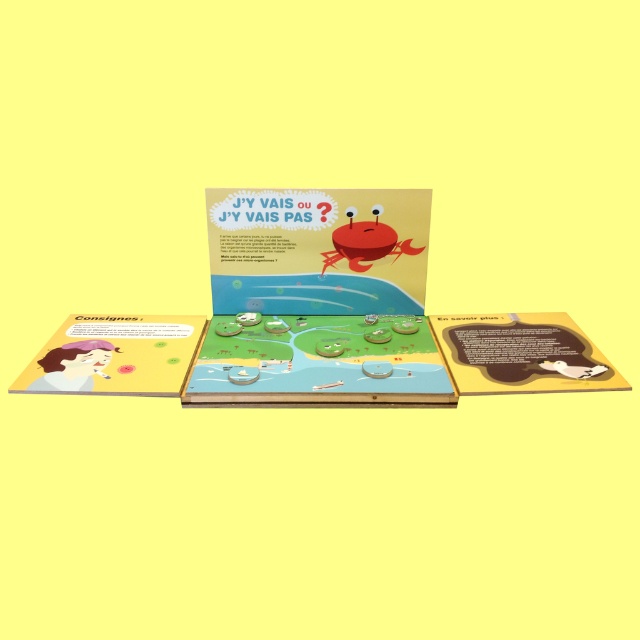
Can you confirm if matte plastic game board at center is shorter than matte yellow paper at lower left?

Incorrect, matte plastic game board at center's height does not fall short of matte yellow paper at lower left's.

Does point (220, 365) come behind point (112, 333)?

That is False.

This screenshot has height=640, width=640. I want to click on matte plastic game board at center, so click(320, 362).

Is matte plastic game board at center thinner than brown matte book at lower right?

No, matte plastic game board at center is not thinner than brown matte book at lower right.

Is point (330, 403) more distant than point (481, 342)?

No, (330, 403) is in front of (481, 342).

The image size is (640, 640). I want to click on matte plastic game board at center, so click(320, 362).

Does matte yellow paper at lower left appear over brown matte book at lower right?

Incorrect, matte yellow paper at lower left is not positioned above brown matte book at lower right.

From the picture: Which is below, matte yellow paper at lower left or brown matte book at lower right?

matte yellow paper at lower left is below.

Image resolution: width=640 pixels, height=640 pixels. What are the coordinates of `matte yellow paper at lower left` in the screenshot? It's located at (115, 355).